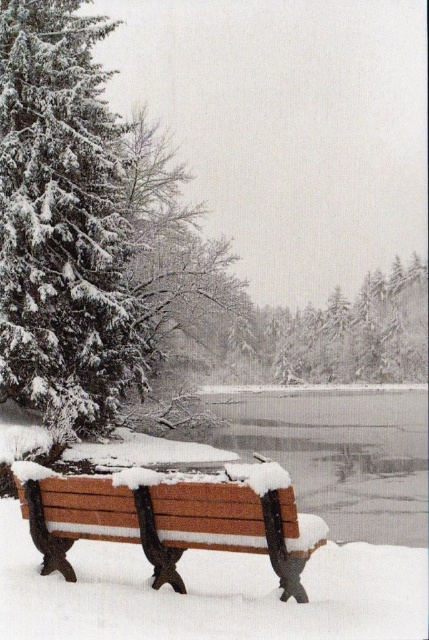
Between snow-covered evergreen at left and wooden bench at lower center, which one has more height?

snow-covered evergreen at left

This screenshot has width=429, height=640. I want to click on snow-covered evergreen at left, so click(x=63, y=224).